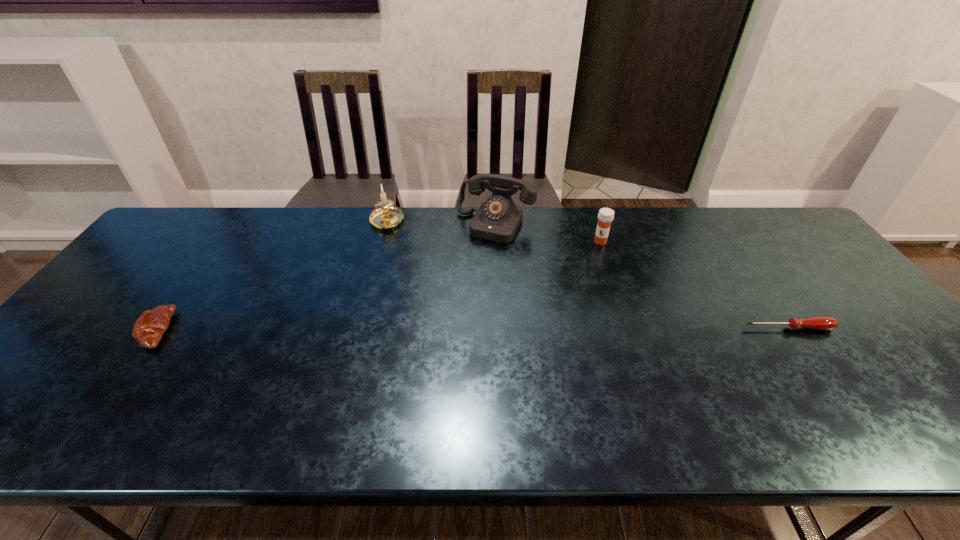
Find the location of a particular element. This screenshot has width=960, height=540. candle holder situated at the far edge is located at coordinates (386, 216).

Locate an element on the screen. medicine located at the far edge is located at coordinates (606, 215).

The image size is (960, 540). I want to click on object present at the right edge, so click(817, 323).

At what (x,y) coordinates should I click in order to perform the action: click on vacant region at the far edge. Please return your answer as a coordinate pair (x, y). The width and height of the screenshot is (960, 540). Looking at the image, I should click on (642, 221).

Where is `vacant space at the near edge of the desktop`? vacant space at the near edge of the desktop is located at coordinates (811, 399).

Find the location of `vacant space at the left edge`. vacant space at the left edge is located at coordinates (133, 282).

In order to click on vacant region at the right edge of the desktop in this screenshot , I will do `click(850, 299)`.

In order to click on unoccupied area between the medicine and the crescent roll in this screenshot , I will do `click(379, 286)`.

The height and width of the screenshot is (540, 960). I want to click on free area in between the screwdriver and the third shortest object, so click(x=694, y=285).

This screenshot has width=960, height=540. What are the coordinates of `vacant point located between the screwdriver and the third object from right to left` in the screenshot? It's located at (642, 276).